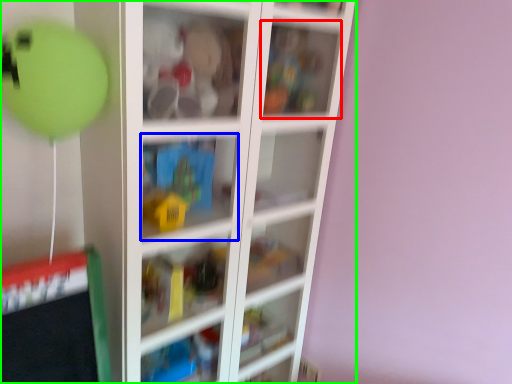
Question: Which object is positioned closest to cabinet (highlighted by a red box)? Select from cabinet (highlighted by a blue box) and shelf (highlighted by a green box).

Choices:
 (A) cabinet
 (B) shelf

Answer: (B)